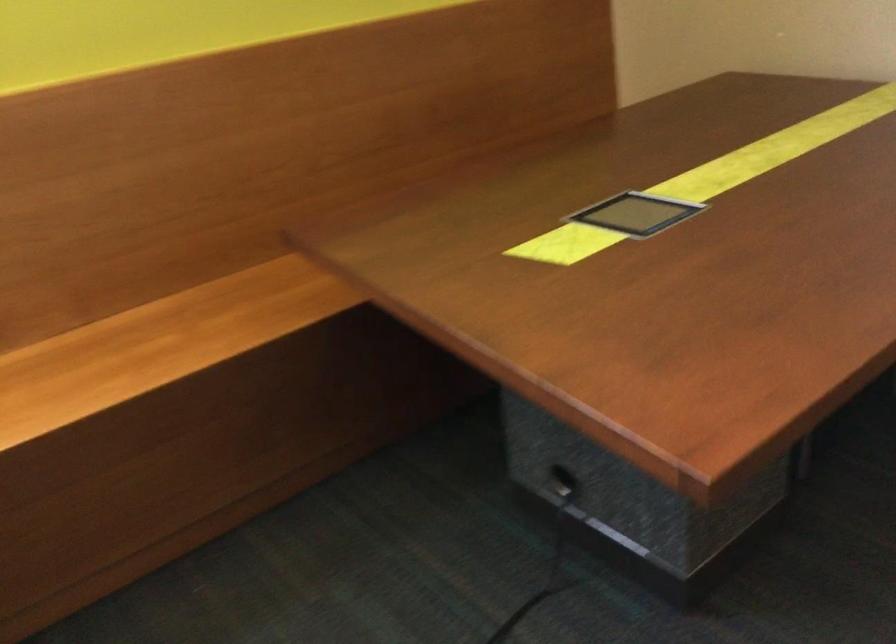
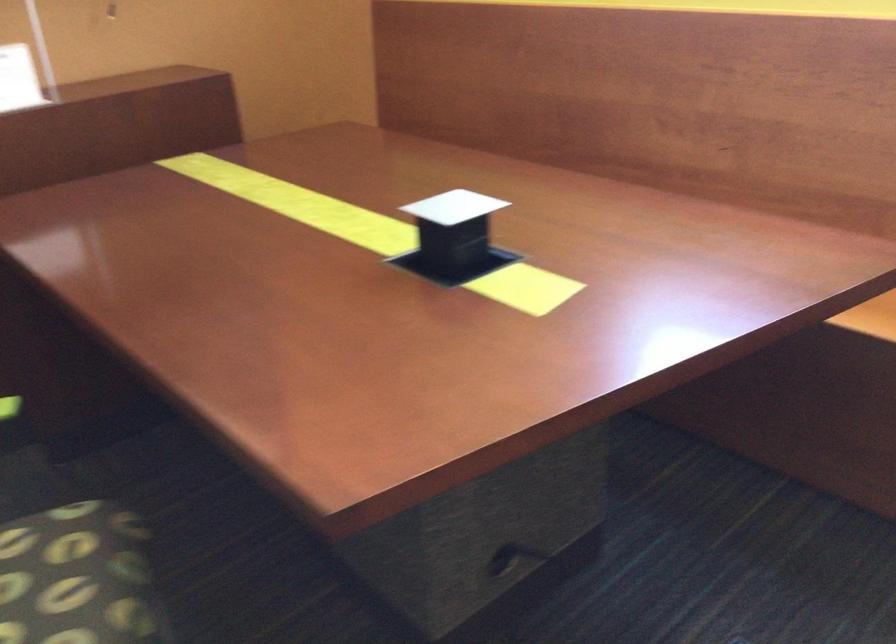
The first image is from the beginning of the video and the second image is from the end. How did the camera likely rotate when shooting the video?

The camera rotated toward left-down.